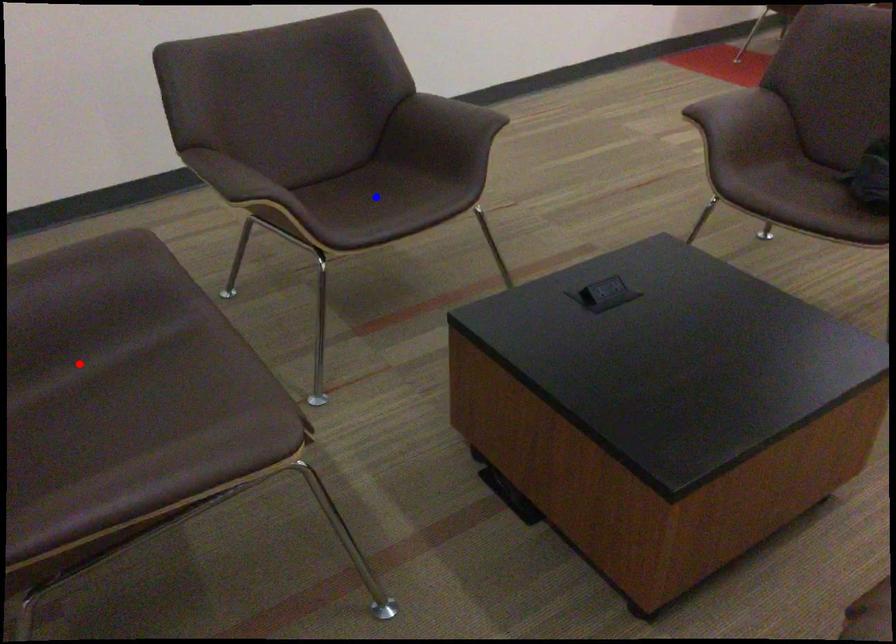
Question: Which of the two points in the image is closer to the camera?

Choices:
 (A) Blue point is closer.
 (B) Red point is closer.

Answer: (B)